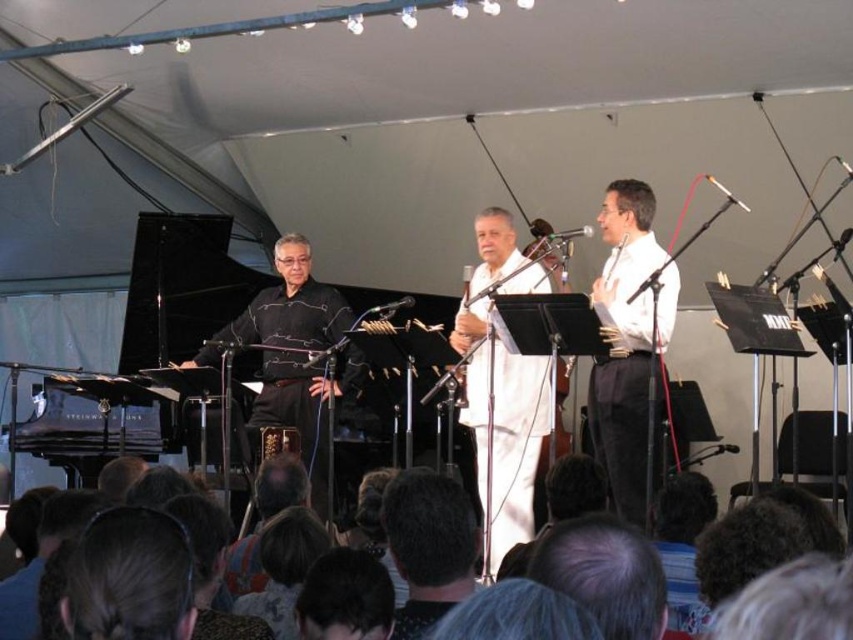
Question: Which point is closer to the camera?

Choices:
 (A) dark brown hair at center
 (B) white cotton conductor at center
 (C) white glossy shirt at center
 (D) black matte shirt at center

Answer: (A)

Question: Is white glossy shirt at center closer to camera compared to dark brown hair at center?

Choices:
 (A) no
 (B) yes

Answer: (A)

Question: Among these points, which one is farthest from the camera?

Choices:
 (A) (576, 545)
 (B) (633, 368)

Answer: (B)

Question: Considering the real-world distances, which object is farthest from the dark brown hair at center?

Choices:
 (A) white cotton conductor at center
 (B) white glossy shirt at center
 (C) dark brown hair at lower center
 (D) black matte shirt at center

Answer: (D)

Question: Is white glossy shirt at center behind dark brown hair at lower center?

Choices:
 (A) no
 (B) yes

Answer: (B)

Question: Is the position of white glossy shirt at center less distant than that of black matte shirt at center?

Choices:
 (A) no
 (B) yes

Answer: (B)